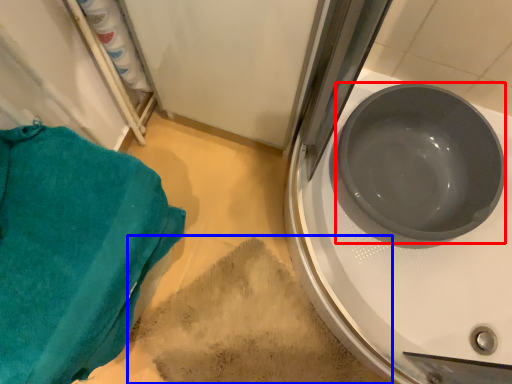
Question: Which object appears farthest to the camera in this image, basin (highlighted by a red box) or dirt (highlighted by a blue box)?

Choices:
 (A) basin
 (B) dirt

Answer: (B)